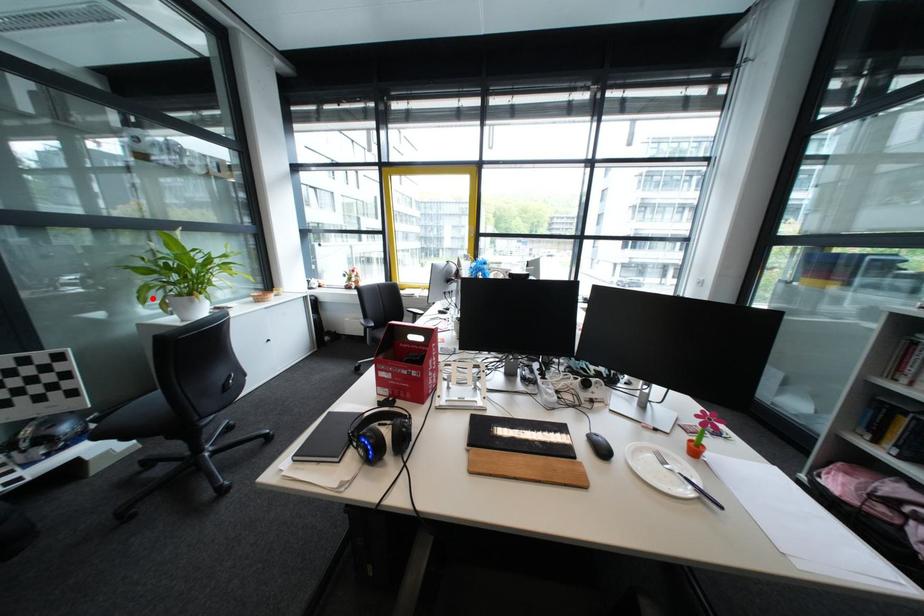
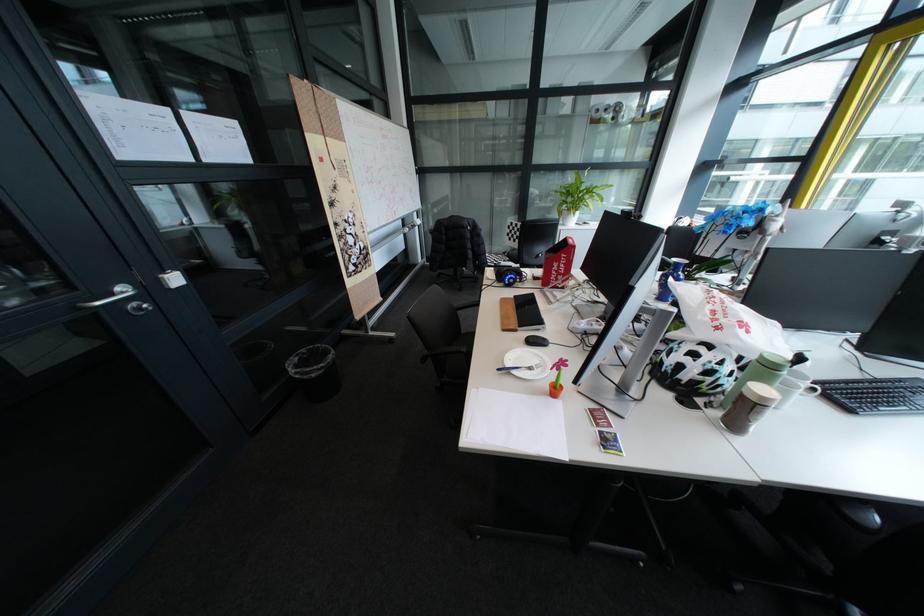
Find the pixel in the second image that matches the highlighted location in the first image.

(572, 209)